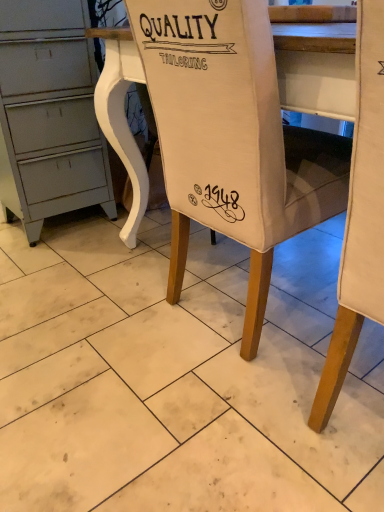
Image resolution: width=384 pixels, height=512 pixels. What do you see at coordinates (232, 137) in the screenshot?
I see `white fabric chair at center` at bounding box center [232, 137].

Measure the distance between point (332, 170) and camera.

The depth of point (332, 170) is 3.47 feet.

Where is `white fabric chair at center`? This screenshot has height=512, width=384. white fabric chair at center is located at coordinates (232, 137).

Find the location of `white fabric chair at center`. white fabric chair at center is located at coordinates (232, 137).